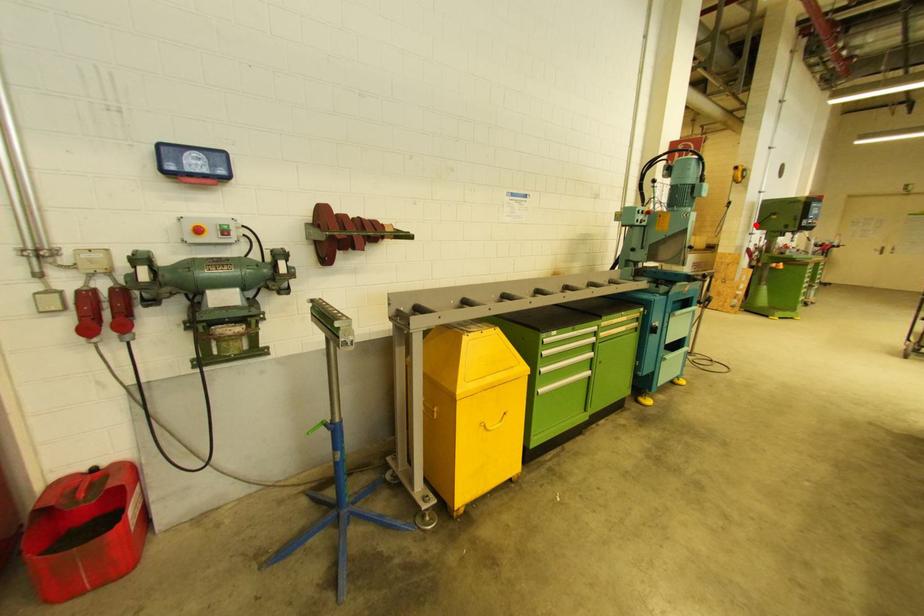
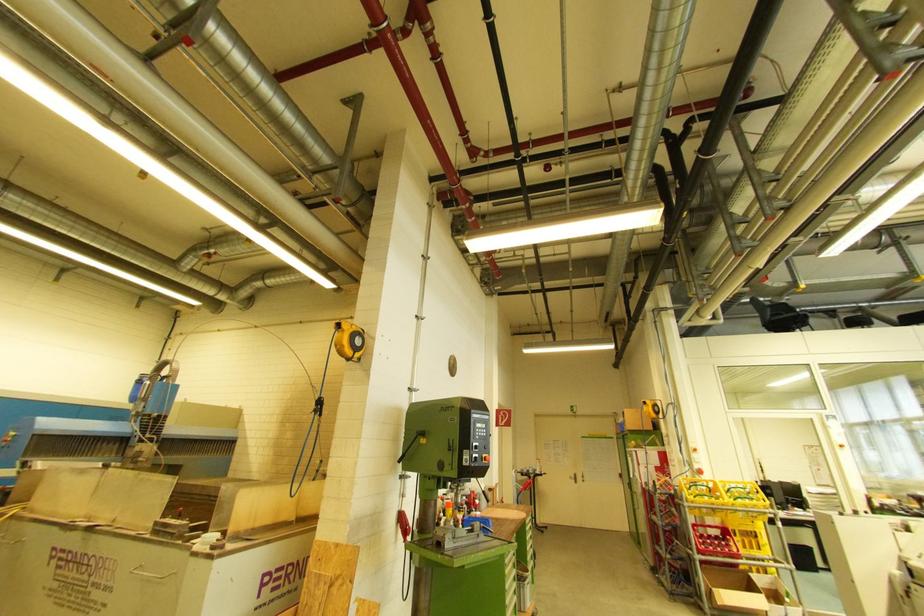
Where in the second image is the point corresponding to the highlighted location from the first image?

(403, 456)